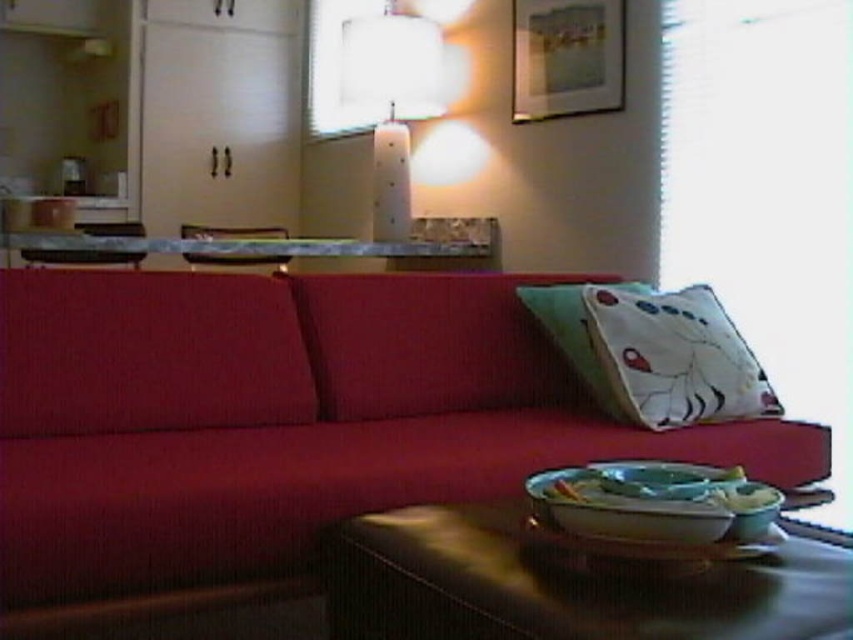
Question: Is shiny brown table at lower center smaller than white cotton pillow at center?

Choices:
 (A) no
 (B) yes

Answer: (A)

Question: Among these objects, which one is farthest from the camera?

Choices:
 (A) velvet red couch at center
 (B) white glossy lamp at upper center

Answer: (B)

Question: Can you confirm if shiny brown table at lower center is thinner than white cotton pillow at center?

Choices:
 (A) no
 (B) yes

Answer: (A)

Question: Can you confirm if shiny brown table at lower center is thinner than white cotton pillow at center?

Choices:
 (A) yes
 (B) no

Answer: (B)

Question: Which object is the closest to the white cotton pillow at center?

Choices:
 (A) white cotton pillow at right
 (B) metallic silver table at center

Answer: (A)

Question: Which point is closer to the camera taking this photo?

Choices:
 (A) (422, 620)
 (B) (248, 241)
 (C) (698, 292)
 (D) (347, 64)

Answer: (A)